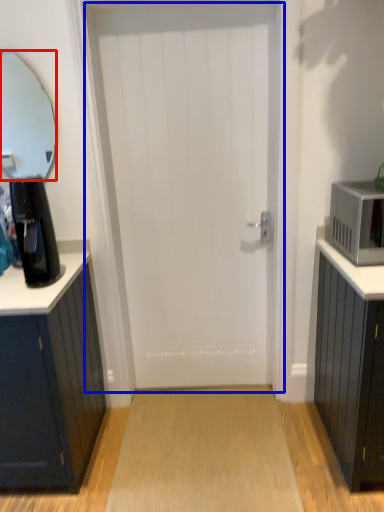
Question: Which of the following is the closest to the observer, mirror (highlighted by a red box) or door (highlighted by a blue box)?

Choices:
 (A) mirror
 (B) door

Answer: (B)